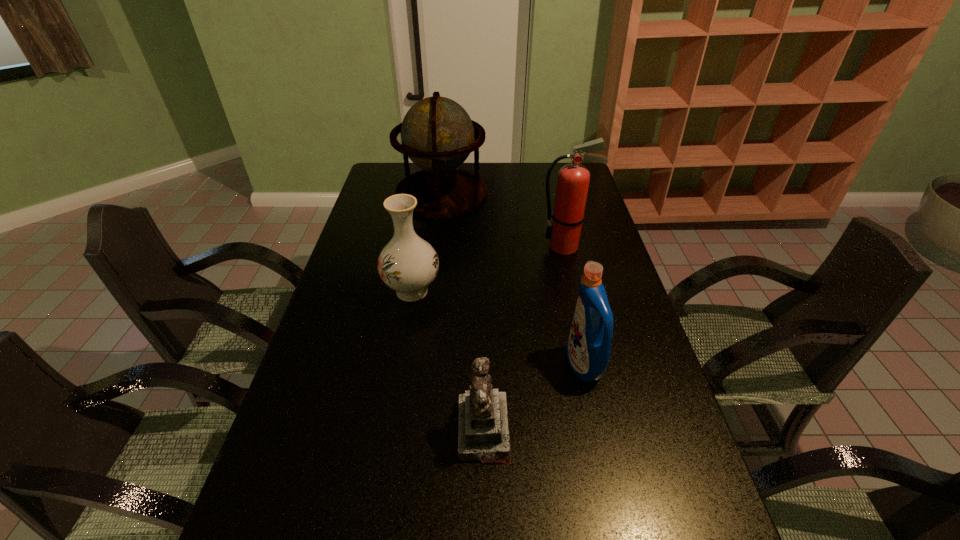
The image size is (960, 540). I want to click on globe, so click(x=437, y=134).

You are a GUI agent. You are given a task and a screenshot of the screen. Output one action in this format:
    pyautogui.click(x=<x>, y=<y>)
    Task: Click on the second farthest object
    Image resolution: width=960 pixels, height=540 pixels.
    Given the screenshot: What is the action you would take?
    pyautogui.click(x=573, y=180)

This screenshot has width=960, height=540. I want to click on the third nearest object, so click(x=408, y=264).

At what (x,y) coordinates should I click in order to perform the action: click on the second nearest object. Please return your answer as a coordinate pair (x, y). This screenshot has height=540, width=960. Looking at the image, I should click on (588, 348).

Locate an element on the screen. Image resolution: width=960 pixels, height=540 pixels. the nearest object is located at coordinates (483, 434).

The width and height of the screenshot is (960, 540). I want to click on figurine, so click(x=483, y=434).

Locate an element on the screen. Image resolution: width=960 pixels, height=540 pixels. vacant space located on the front-facing side of the farthest object is located at coordinates click(x=438, y=226).

This screenshot has height=540, width=960. Find the location of `vacant position located on the hose direction of the second farthest object`. vacant position located on the hose direction of the second farthest object is located at coordinates (524, 247).

The width and height of the screenshot is (960, 540). I want to click on vacant space located 0.340m on the hose direction of the second farthest object, so pos(440,247).

You are a GUI agent. You are given a task and a screenshot of the screen. Output one action in this format:
    pyautogui.click(x=<x>, y=<y>)
    Task: Click on the free space located 0.170m on the hose direction of the second farthest object
    The image size is (960, 540).
    Given the screenshot: What is the action you would take?
    pyautogui.click(x=490, y=247)